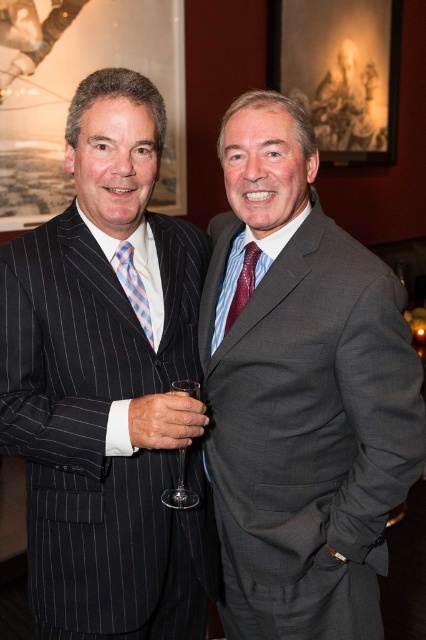
Question: Is gray wool suit at right wider than light blue striped tie at center?

Choices:
 (A) no
 (B) yes

Answer: (B)

Question: Does gray wool suit at right appear over clear glass wine glass at center?

Choices:
 (A) no
 (B) yes

Answer: (B)

Question: From the image, what is the correct spatial relationship of pinstriped wool suit at left in relation to clear glass wine glass at center?

Choices:
 (A) below
 (B) above

Answer: (B)

Question: Considering the real-world distances, which object is farthest from the light blue striped tie at center?

Choices:
 (A) pinstriped wool suit at left
 (B) clear glass wine glass at center
 (C) gray wool suit at right

Answer: (C)

Question: Which point appears closest to the camera in this image?

Choices:
 (A) (167, 493)
 (B) (143, 486)
 (C) (325, 593)

Answer: (C)

Question: Which point appears closest to the camera in this image?

Choices:
 (A) (75, 428)
 (B) (356, 320)
 (C) (193, 493)
 (D) (138, 312)

Answer: (B)